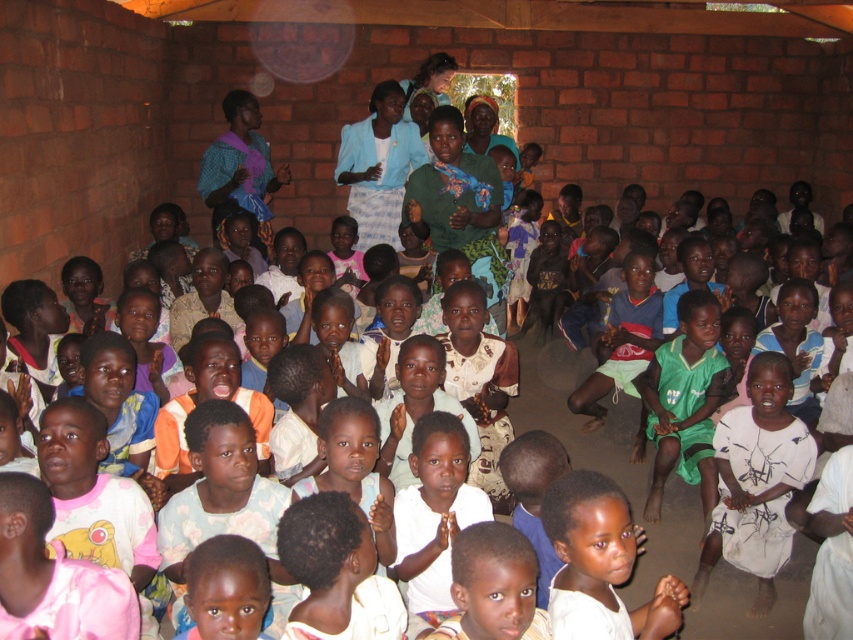
Between white printed dress at lower right and white matte shirt at lower center, which one appears on the left side from the viewer's perspective?

From the viewer's perspective, white matte shirt at lower center appears more on the left side.

Looking at this image, is white printed dress at lower right shorter than white matte shirt at lower center?

In fact, white printed dress at lower right may be taller than white matte shirt at lower center.

What do you see at coordinates (756, 481) in the screenshot? This screenshot has height=640, width=853. I see `white printed dress at lower right` at bounding box center [756, 481].

Where is `white printed dress at lower right`? The height and width of the screenshot is (640, 853). white printed dress at lower right is located at coordinates (756, 481).